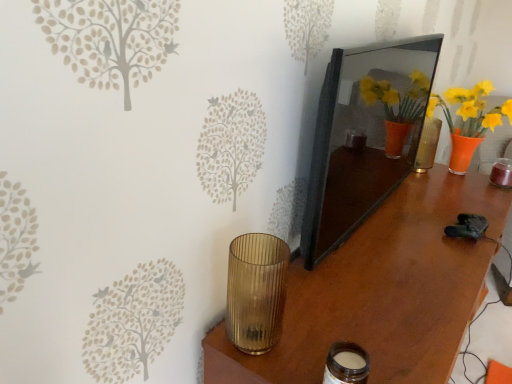
In order to click on free spot in front of matte black mirror at center in this screenshot , I will do `click(387, 288)`.